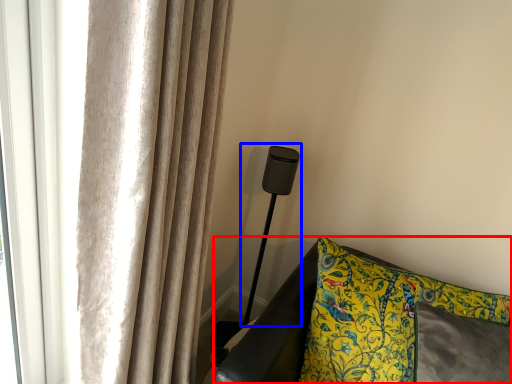
Question: Which point is closer to the camera, furniture (highlighted by a red box) or table lamp (highlighted by a blue box)?

Choices:
 (A) furniture
 (B) table lamp

Answer: (A)